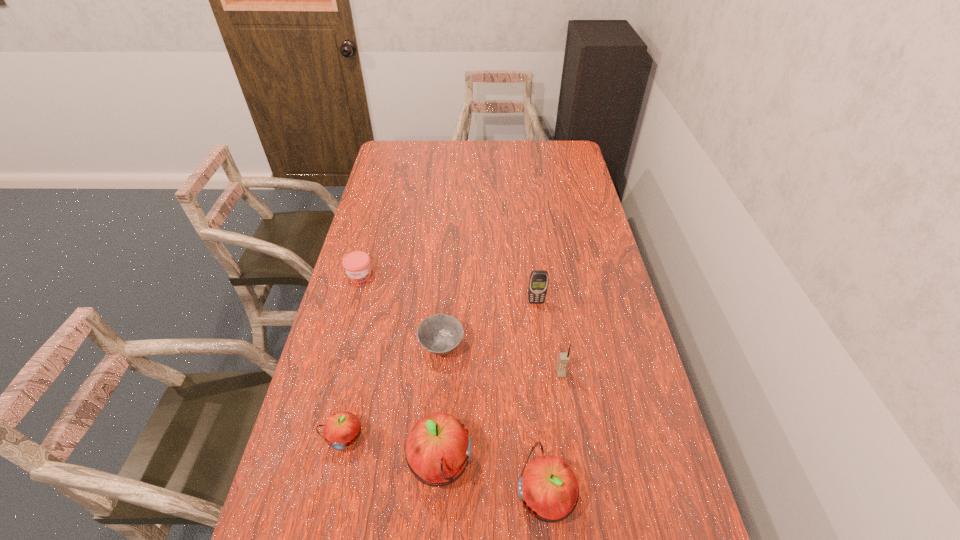
Considering the uniform spacing of apples, where should an additional apple be positioned on the right? Please locate a free spot. Please provide its 2D coordinates. Your answer should be formatted as a tuple, i.e. [(x, y)], where the tuple contains the x and y coordinates of a point satisfying the conditions above.

[(661, 529)]